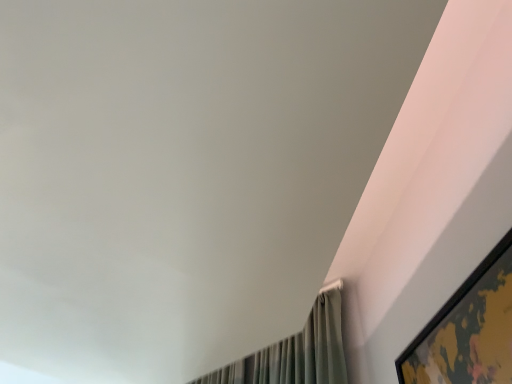
Image resolution: width=512 pixels, height=384 pixels. I want to click on wooden framed map at upper right, so click(468, 330).

The height and width of the screenshot is (384, 512). Describe the element at coordinates (468, 330) in the screenshot. I see `wooden framed map at upper right` at that location.

In order to click on wooden framed map at upper right in this screenshot , I will do `click(468, 330)`.